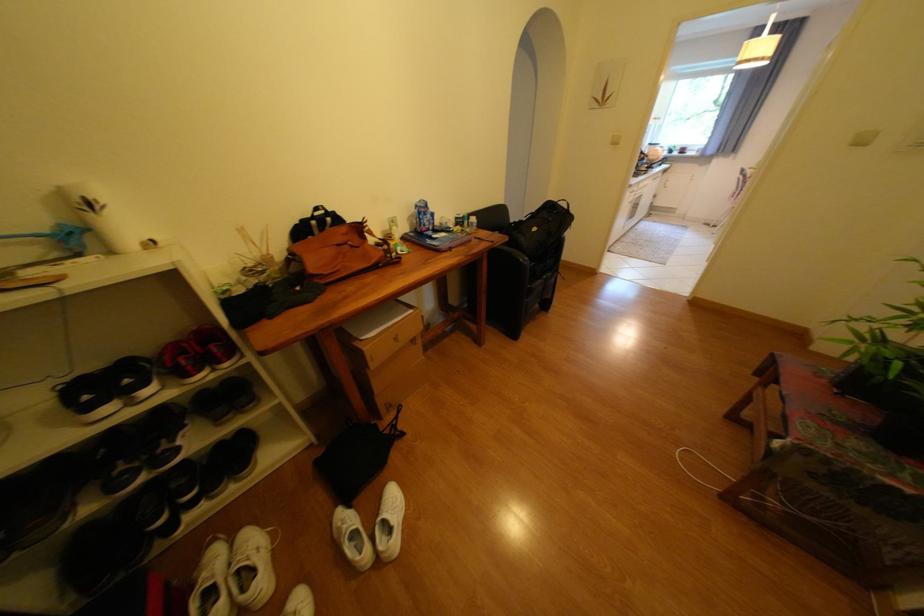
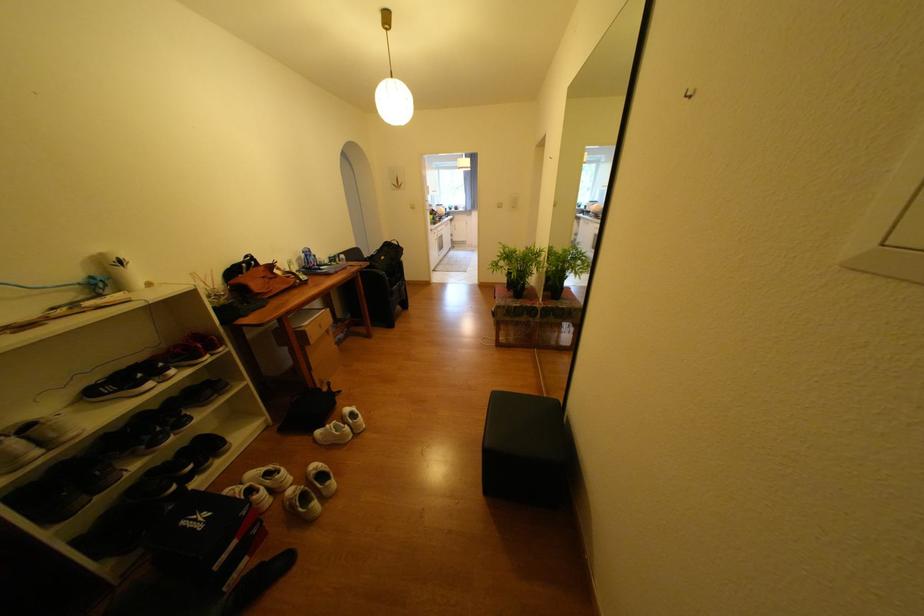
Where in the second image is the point corresponding to point 721,151 from the first image?

(479, 208)